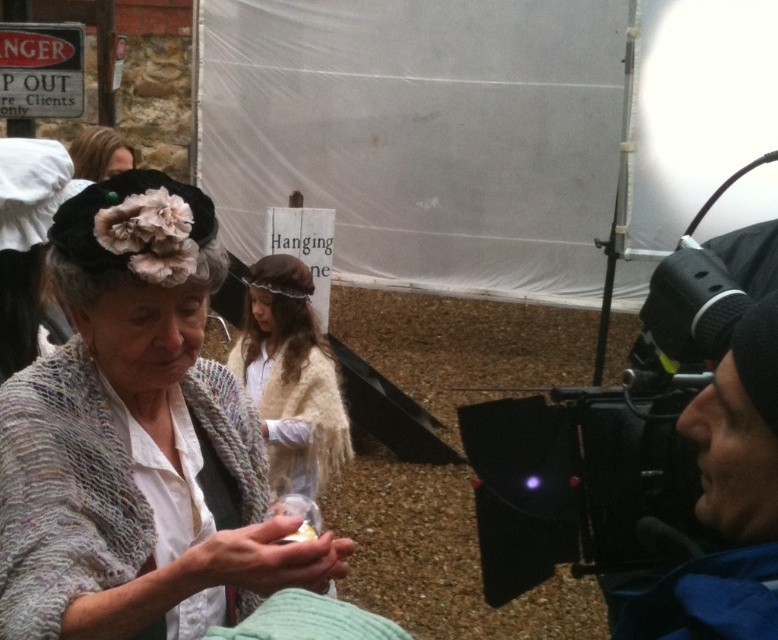
You are a costume designer working on a historical drama. You need to ensure that the two shawls worn by the actress are positioned correctly for the scene. The camera will be placed 2 meters away from the knitted woolen shawl at center. Will the beige woolen shawl at center be visible in the camera frame if the camera has a 1.5 meter focal length?

The distance between the knitted woolen shawl at center and the beige woolen shawl at center is 1.64 meters. Since the camera is placed 2 meters away from the knitted woolen shawl at center and has a 1.5 meter focal length, the beige woolen shawl at center would be within the camera frame as it is only 1.64 meters away from the focal point.

You are a film crew member setting up equipment. You have to decide whether the black matte video camera at right can be placed on a shelf that is 20 cm tall. The shelf is currently holding the matte black hat at upper left. Can the camera be placed there without exceeding the shelf height?

The black matte video camera at right is much taller than the matte black hat at upper left. Since the shelf is only 20 cm tall, and the camera is taller than the hat, it likely exceeds the shelf height. Therefore, the camera cannot be placed there.

You are a film director checking the camera setup. You need to ensure that the black matte video camera at right can capture the entire matte black hat at upper left in the frame. Given their widths, will the camera be able to capture the hat fully?

The black matte video camera at right has a greater width than the matte black hat at upper left, so it should be able to capture the entire hat in the frame.